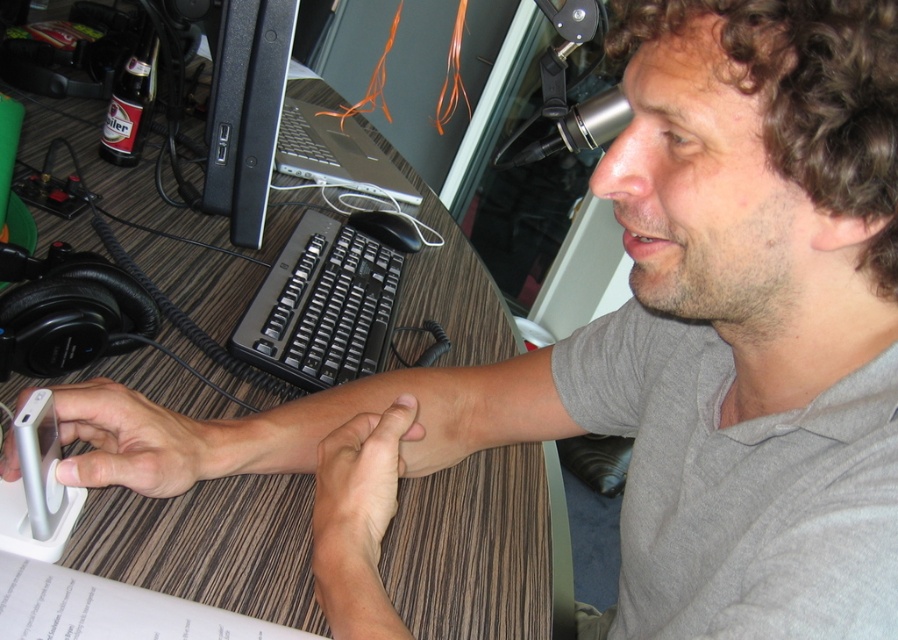
You are setting up a new desk arrangement and want to place a lamp between the black plastic computer monitor at upper left and the silver metallic phone at lower left. Based on their positions, where should the lamp be placed relative to the monitor?

The lamp should be placed to the right of the black plastic computer monitor at upper left since the silver metallic phone at lower left is positioned to the right of the monitor.

You are a delivery person standing at the entrance of the room. You need to place a package on the desk without touching the silver metallic phone at lower left. The package requires 30 centimeters of space. Is there enough space on the desk to place the package?

The silver metallic phone at lower left is 51.03 centimeters away from the viewer. Since the package needs 30 centimeters of space, there is enough space to place the package on the desk without touching the silver metallic phone at lower left.

You are a delivery person who needs to place a package on the desk. The package is too large to fit on the desk, so you have to place it on the floor. However, there is a narrow path between the black plastic computer monitor at upper left and the silver metallic phone at lower left. Can you navigate through this path with the package?

The black plastic computer monitor at upper left is further to the viewer than the silver metallic phone at lower left, so the path between them is narrow but navigable. The delivery person can carefully move the package through the path between the black plastic computer monitor at upper left and the silver metallic phone at lower left.